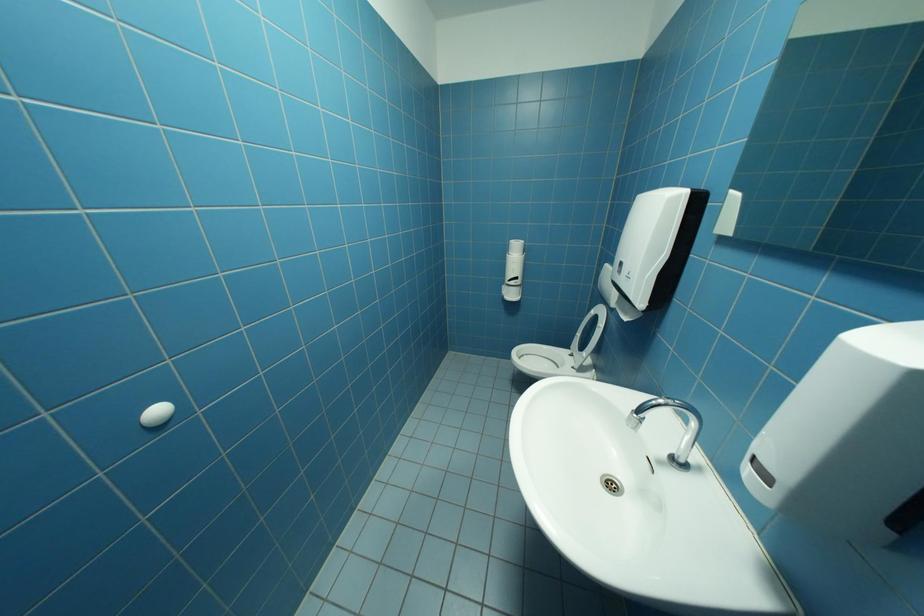
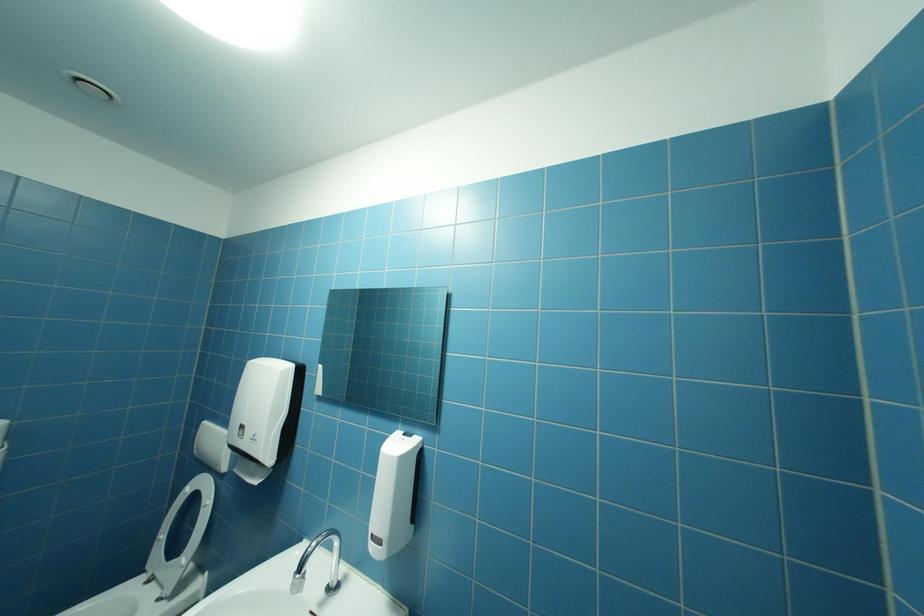
Question: The camera is either moving clockwise (left) or counter-clockwise (right) around the object. The first image is from the beginning of the video and the second image is from the end. Is the camera moving left or right when shooting the video?

Choices:
 (A) Left
 (B) Right

Answer: (A)